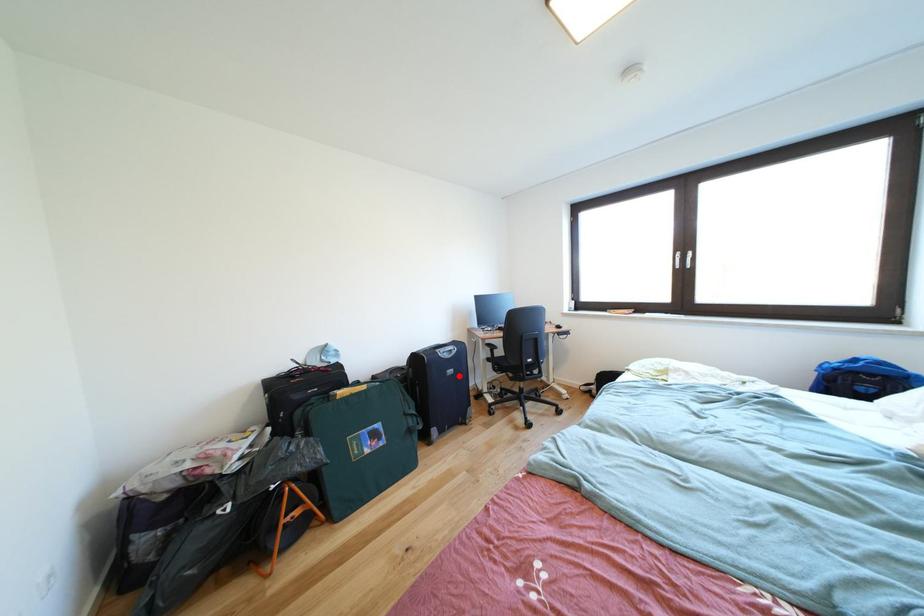
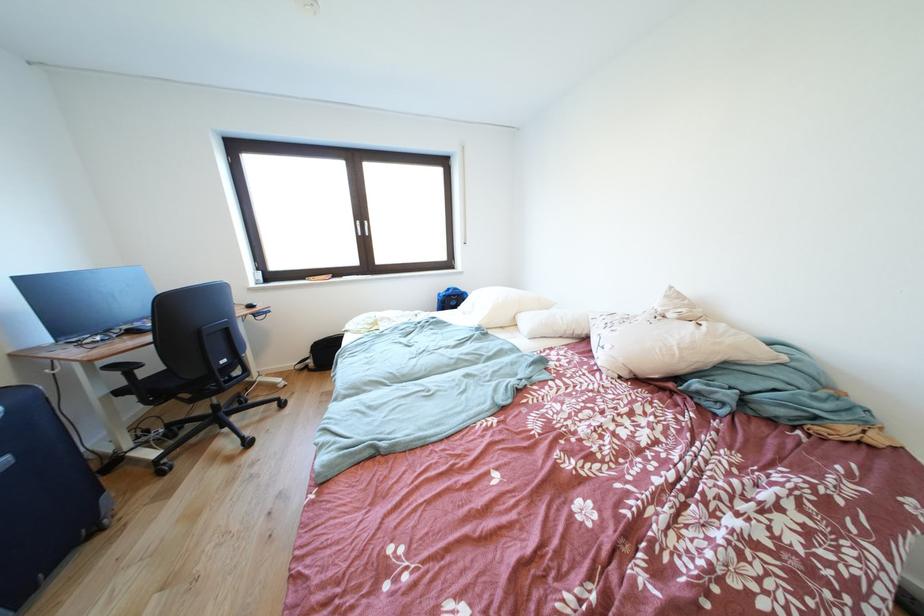
Locate, in the second image, the point that corresponds to the highlighted location in the first image.

(8, 468)